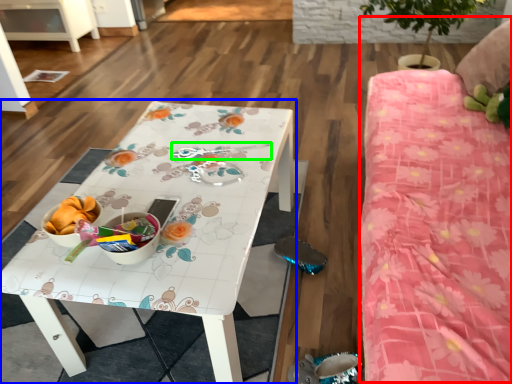
Question: Considering the real-world distances, which object is farthest from bed (highlighted by a red box)? table (highlighted by a blue box) or twin (highlighted by a green box)?

Choices:
 (A) table
 (B) twin

Answer: (B)